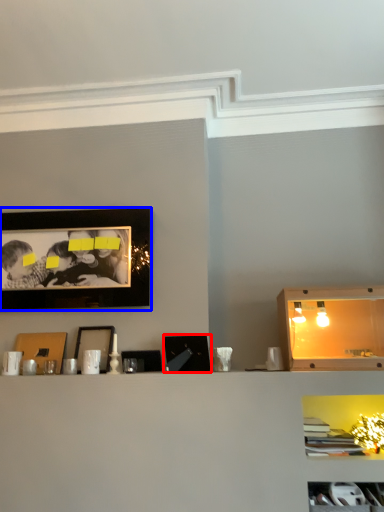
Question: Among these objects, which one is farthest to the camera, picture frame (highlighted by a red box) or picture frame (highlighted by a blue box)?

Choices:
 (A) picture frame
 (B) picture frame

Answer: (B)